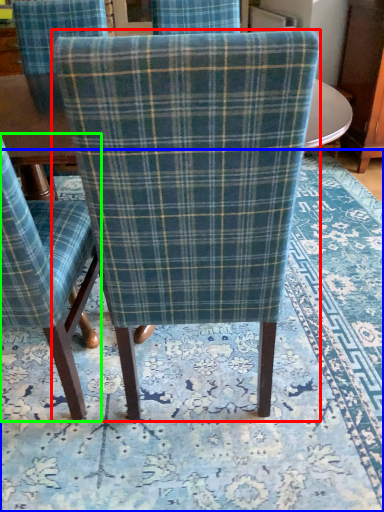
Question: Which object is the farthest from chair (highlighted by a red box)? Choose among these: mat (highlighted by a blue box) or chair (highlighted by a green box).

Choices:
 (A) mat
 (B) chair

Answer: (A)